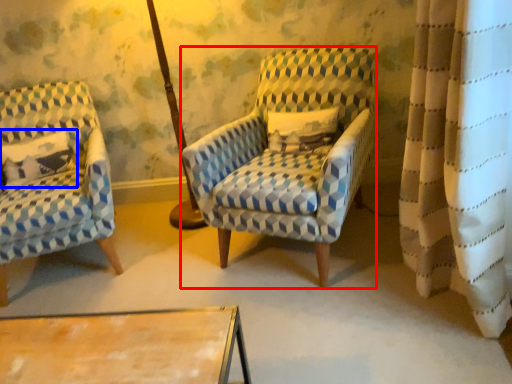
Question: Which of the following is the closest to the observer, chair (highlighted by a red box) or pillow (highlighted by a blue box)?

Choices:
 (A) chair
 (B) pillow

Answer: (A)